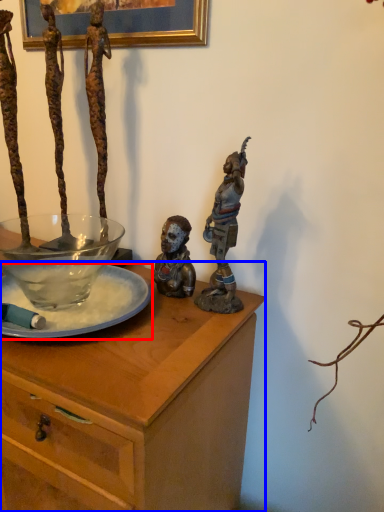
Question: Which point is closer to the camera, glass plate (highlighted by a red box) or desk (highlighted by a blue box)?

Choices:
 (A) glass plate
 (B) desk

Answer: (B)